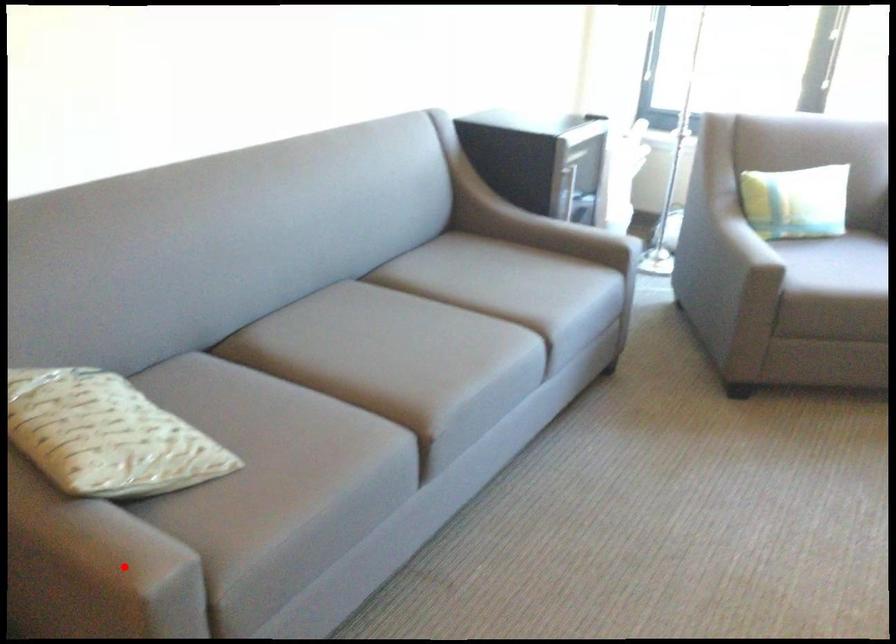
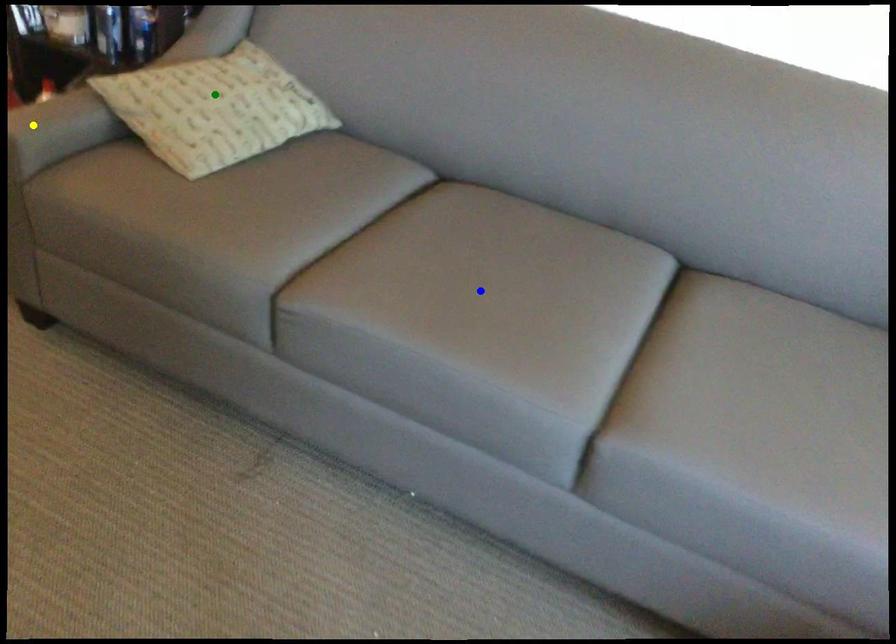
Question: I am providing you with two images of the same scene from different viewpoints. A red point is marked on the first image. You are given multiple points on the second image. Which point in image 2 represents the same 3d spot as the red point in image 1?

Choices:
 (A) blue point
 (B) green point
 (C) yellow point

Answer: (C)